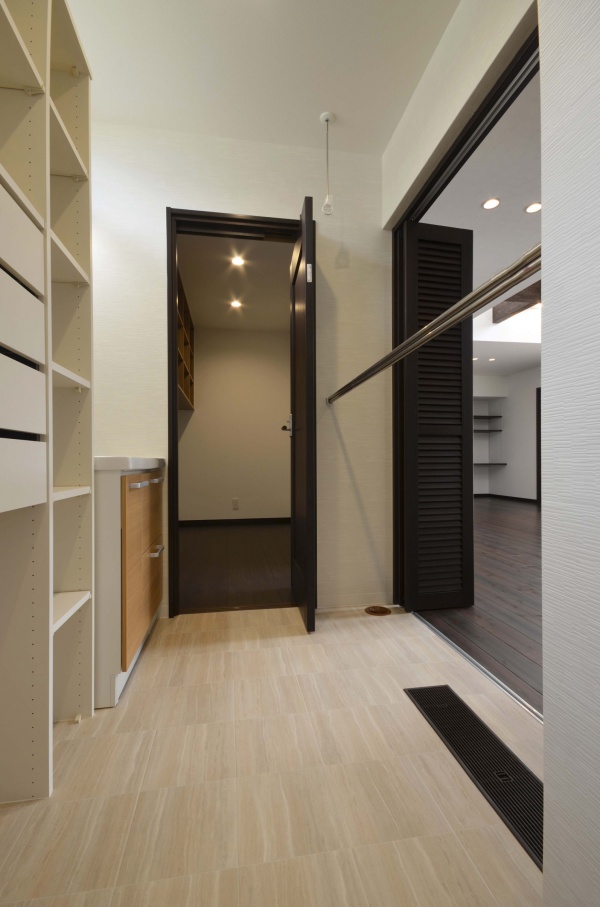
Identify the location of floor grate. The height and width of the screenshot is (907, 600). (515, 808).